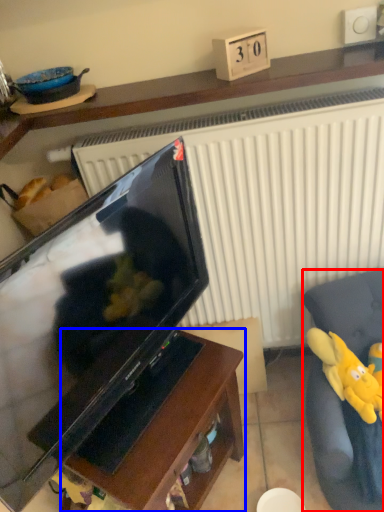
Question: Which object appears farthest to the camera in this image, furniture (highlighted by a red box) or furniture (highlighted by a blue box)?

Choices:
 (A) furniture
 (B) furniture

Answer: (B)